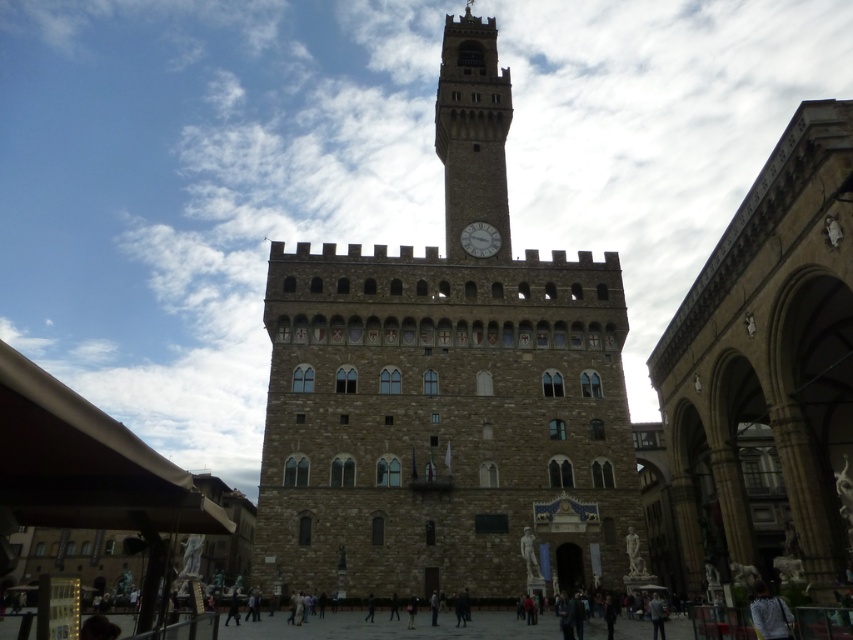
Question: Can you confirm if brown stone clock tower at upper center is positioned above white glossy clock at center?

Choices:
 (A) yes
 (B) no

Answer: (A)

Question: Is brown stone tower at center positioned before white glossy clock at center?

Choices:
 (A) yes
 (B) no

Answer: (A)

Question: Which object appears closest to the camera in this image?

Choices:
 (A) brown stone clock tower at upper center
 (B) white glossy clock at center

Answer: (A)

Question: Which of the following is the closest to the observer?

Choices:
 (A) (479, 83)
 (B) (476, 250)

Answer: (B)

Question: Which point is farther to the camera?

Choices:
 (A) white glossy clock at center
 (B) brown stone tower at center

Answer: (A)

Question: From the image, what is the correct spatial relationship of brown stone tower at center in relation to white glossy clock at center?

Choices:
 (A) left
 (B) right

Answer: (A)